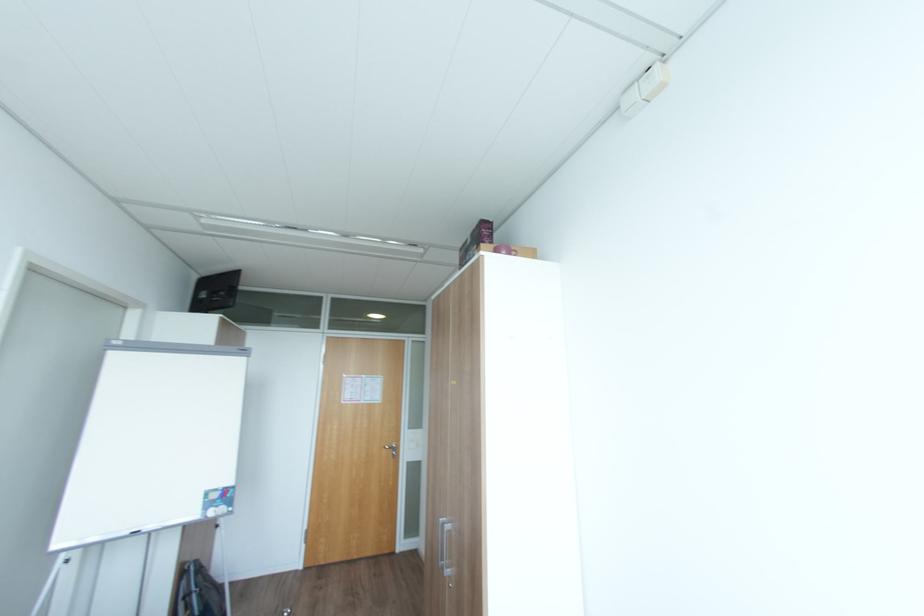
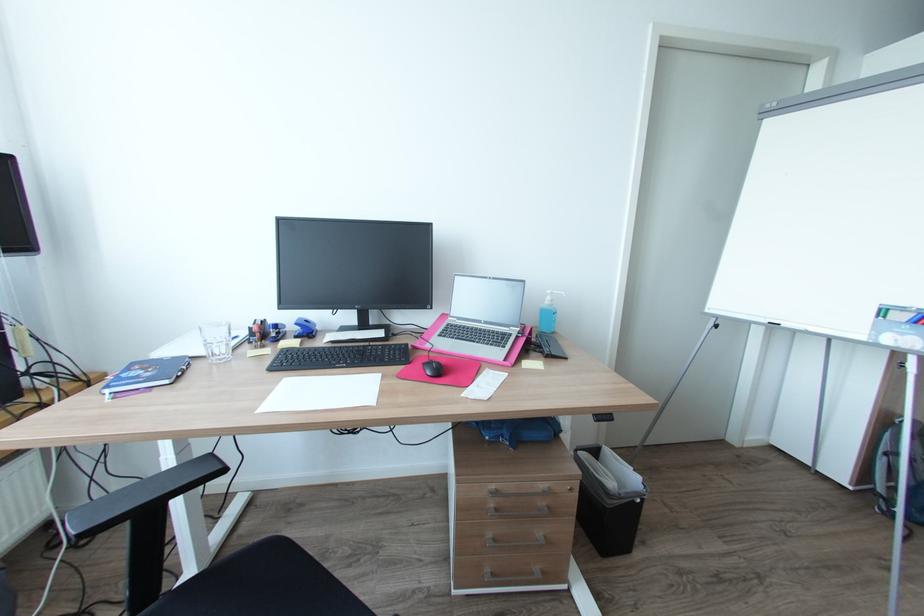
Question: How did the camera likely rotate?

Choices:
 (A) Left
 (B) Right
 (C) Up
 (D) Down

Answer: (A)